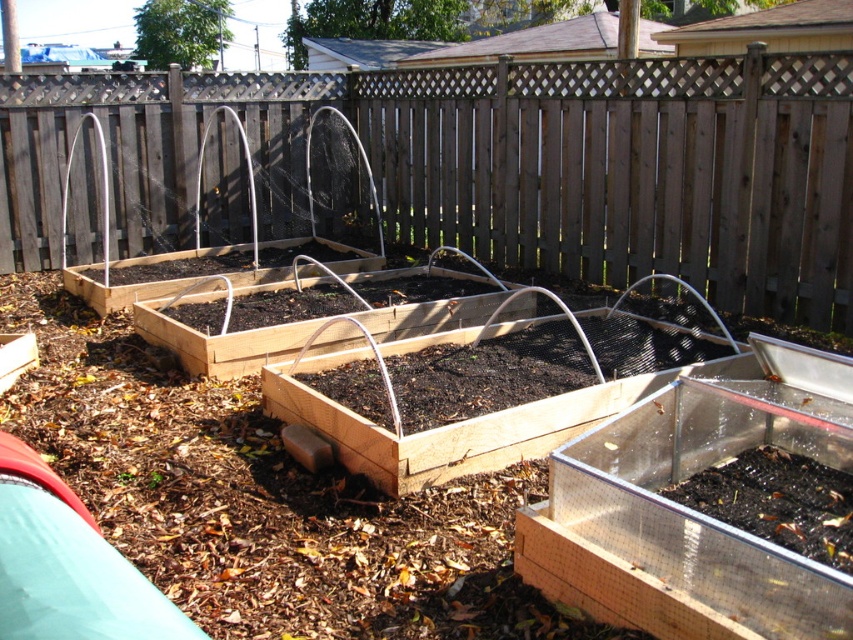
Question: Is brown wooden fence at upper center closer to the viewer compared to brown wooden raised bed at center?

Choices:
 (A) yes
 (B) no

Answer: (B)

Question: Can you confirm if brown wooden fence at upper center is wider than brown wooden raised bed at center?

Choices:
 (A) no
 (B) yes

Answer: (A)

Question: Does brown wooden fence at upper center lie behind brown wooden raised bed at center?

Choices:
 (A) no
 (B) yes

Answer: (B)